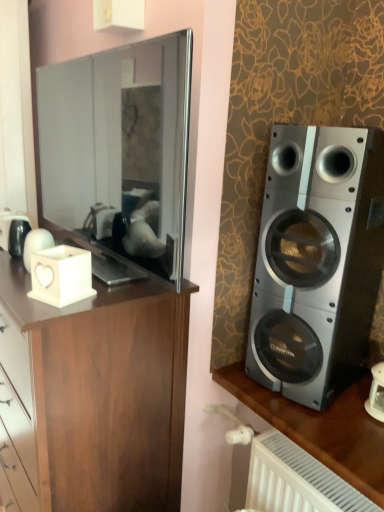
Locate an element on the screen. vacant space in front of white matte candle holder at left is located at coordinates [x=40, y=307].